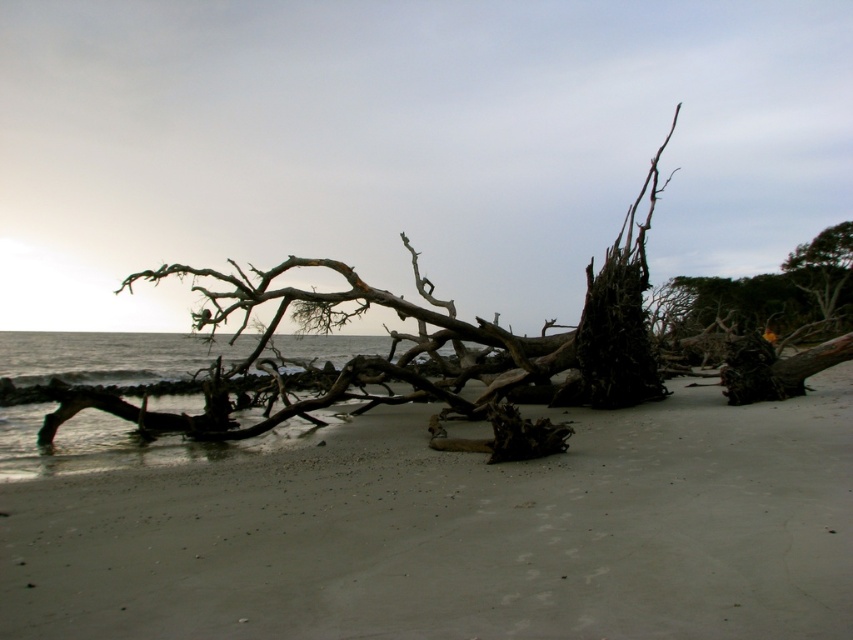
You are standing on the beach and see a gray sand at center. There is a point marked at coordinates (459, 532). Is this point located on the gray sand at center?

Yes, the point (459, 532) is on the gray sand at center.

You are standing at the origin point of the coordinate system. You want to walk to the gray sand at center. What are the coordinates you need to move to?

The coordinates you need to move to are approximately 0.834 in the x direction and 0.539 in the y direction.